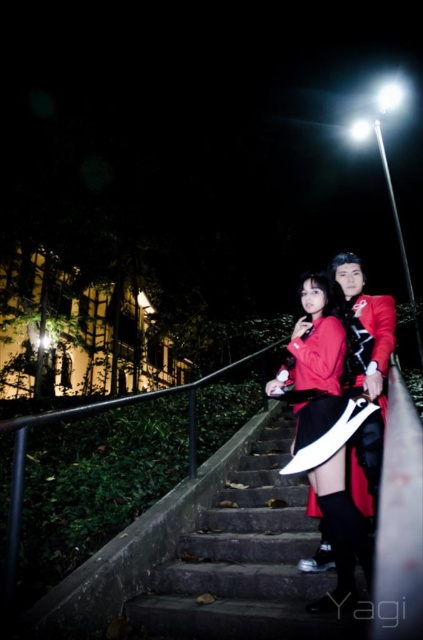
Question: Which point appears farthest from the camera in this image?

Choices:
 (A) (211, 532)
 (B) (354, 502)

Answer: (A)

Question: Which point is closer to the camera?

Choices:
 (A) (307, 371)
 (B) (367, 449)
 (C) (277, 612)

Answer: (C)

Question: Based on their relative distances, which object is nearer to the velvet red dress at center?

Choices:
 (A) smooth concrete stairs at center
 (B) matte red jacket at center

Answer: (B)

Question: Can you confirm if matte red jacket at center is wider than velvet red dress at center?

Choices:
 (A) yes
 (B) no

Answer: (A)

Question: Is matte red jacket at center closer to the viewer compared to velvet red dress at center?

Choices:
 (A) no
 (B) yes

Answer: (A)

Question: Does smooth concrete stairs at center appear on the left side of matte red jacket at center?

Choices:
 (A) yes
 (B) no

Answer: (A)